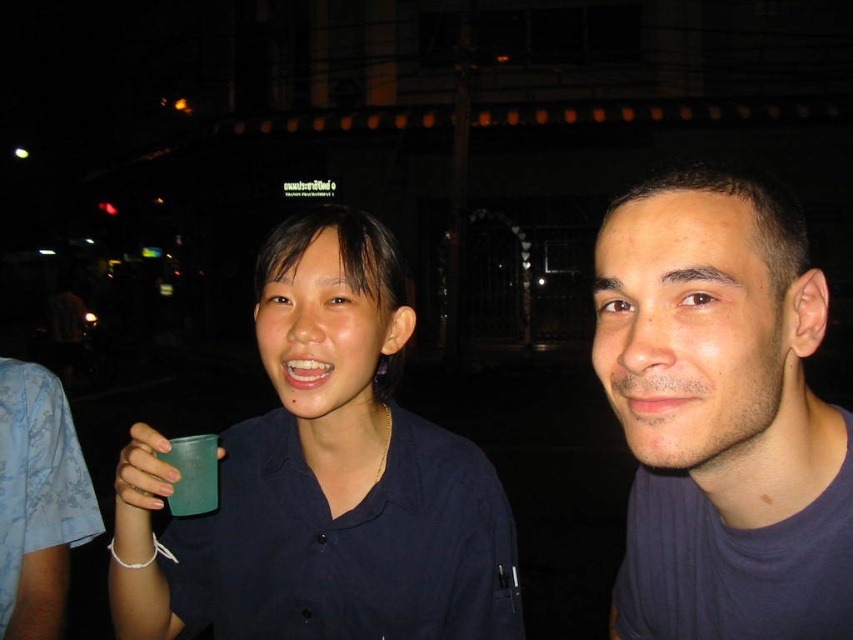
You are a photographer trying to position a spotlight at point (721,417) in the image. Which object from the scene should you focus the spotlight on?

The dark blue t shirt at right is located at point (721,417), so you should focus the spotlight on the dark blue t shirt at right.

You are a photographer trying to capture the matte plastic cup at center and the green plastic cup at lower left in a clear photo. Since the camera can only focus on one object at a time, which cup should you focus on to ensure the other remains in the background?

You should focus on the matte plastic cup at center because it is in front of the green plastic cup at lower left, so the green plastic cup at lower left will naturally be in the background when the matte plastic cup at center is in focus.